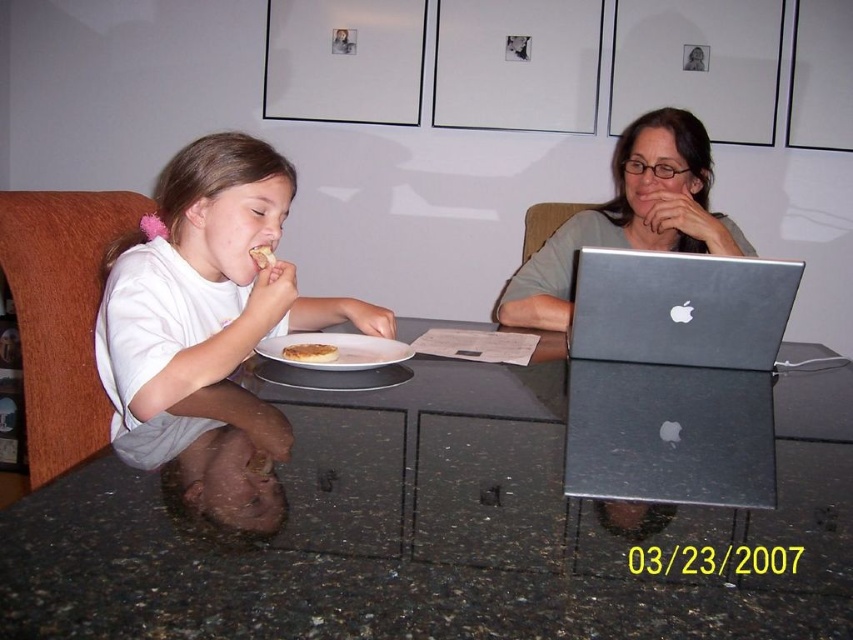
What is the exact coordinate of the silver metallic laptop at center?

The silver metallic laptop at center is located at point (680, 308).

You are a delivery person who needs to place a small package on the table between the silver metallic laptop at center and the white matte plate at center. Can you fit it there without moving either object?

The silver metallic laptop at center is bigger than the white matte plate at center, so there might not be enough space between them to place the small package without moving either object.